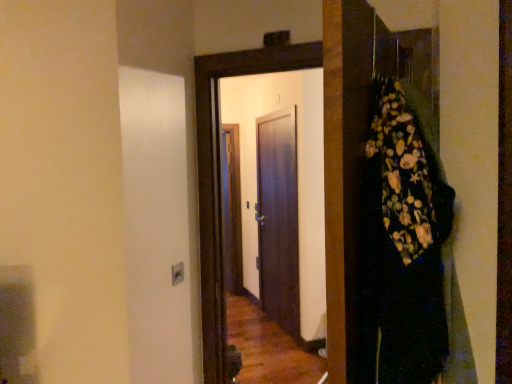
Question: In terms of size, does dark wood door at center, the first door viewed from the front, appear bigger or smaller than dark wood door at center, which is counted as the 2th door, starting from the front?

Choices:
 (A) small
 (B) big

Answer: (A)

Question: From a real-world perspective, is dark wood door at center, acting as the second door starting from the back, physically located above or below dark wood door at center, which is counted as the 2th door, starting from the front?

Choices:
 (A) above
 (B) below

Answer: (A)

Question: Which object is positioned closest to the dark wood door at center, the first door in the back-to-front sequence?

Choices:
 (A) dark wood door at center, the first door viewed from the front
 (B) floral-patterned fabric at right

Answer: (A)

Question: Considering the real-world distances, which object is closest to the floral-patterned fabric at right?

Choices:
 (A) dark wood door at center, acting as the second door starting from the back
 (B) dark wood door at center, which is counted as the 2th door, starting from the front

Answer: (A)